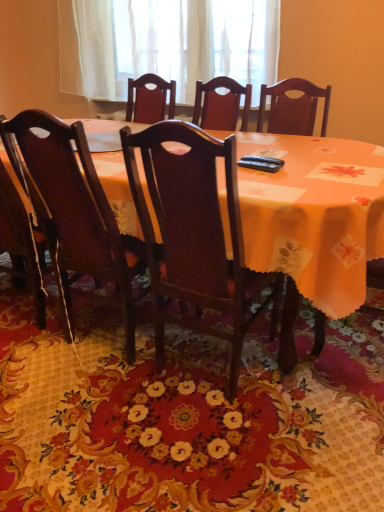
Find the location of a particular element. The height and width of the screenshot is (512, 384). vacant area that is situated to the right of dark wood chair at center, placed as the 1th chair when sorted from right to left is located at coordinates (324, 397).